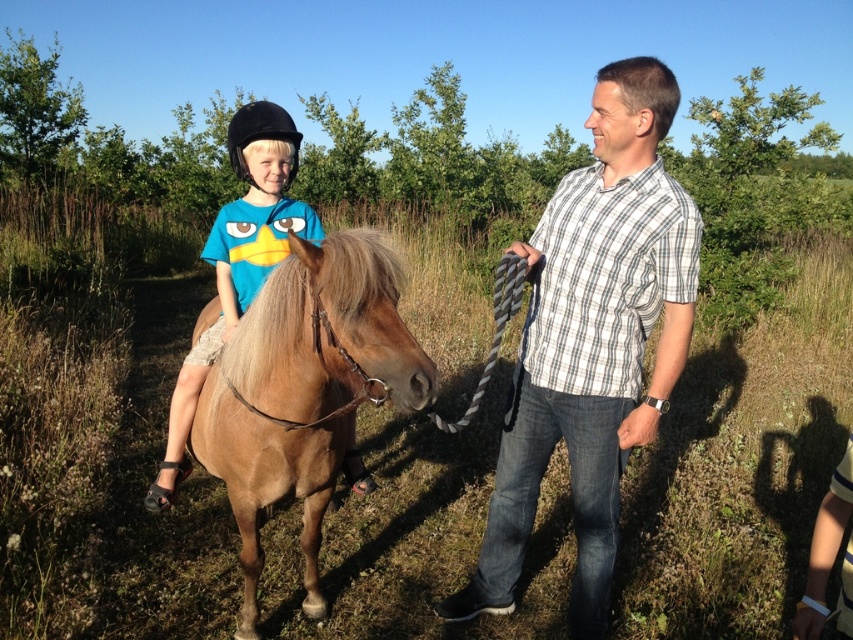
Question: Can you confirm if white checkered shirt at center is positioned above light brown glossy horse at center?

Choices:
 (A) no
 (B) yes

Answer: (B)

Question: In this image, where is white checkered shirt at center located relative to light brown glossy horse at center?

Choices:
 (A) below
 (B) above

Answer: (B)

Question: Which point is farther to the camera?

Choices:
 (A) (260, 444)
 (B) (219, 260)

Answer: (B)

Question: Can you confirm if white checkered shirt at center is smaller than light brown glossy horse at center?

Choices:
 (A) yes
 (B) no

Answer: (B)

Question: Considering the real-world distances, which object is farthest from the matte black helmet at upper left?

Choices:
 (A) white checkered shirt at center
 (B) light brown glossy horse at center

Answer: (A)

Question: Considering the real-world distances, which object is closest to the white checkered shirt at center?

Choices:
 (A) light brown glossy horse at center
 (B) matte black helmet at upper left

Answer: (A)